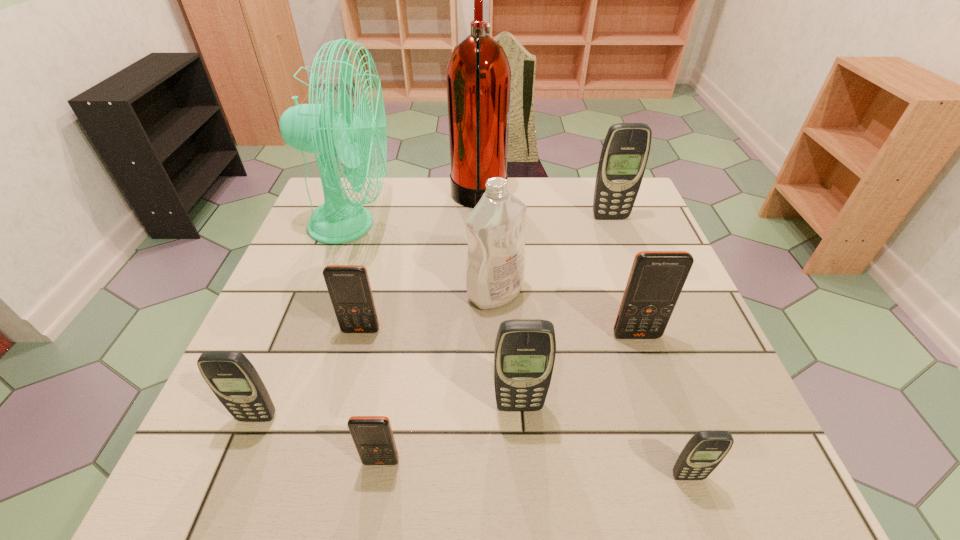
At what (x,y) coordinates should I click in order to perform the action: click on object at the far left corner. Please return your answer as a coordinate pair (x, y). Looking at the image, I should click on (315, 128).

The height and width of the screenshot is (540, 960). Find the location of `object that is at the far right corner`. object that is at the far right corner is located at coordinates (625, 151).

Where is `object that is at the near right corner`? This screenshot has height=540, width=960. object that is at the near right corner is located at coordinates (705, 450).

Find the location of a particular element. This screenshot has width=960, height=540. free space at the far edge of the desktop is located at coordinates tap(456, 216).

What are the coordinates of `vacant space at the near edge` in the screenshot? It's located at (327, 478).

Locate an element on the screen. vacant space at the left edge of the desktop is located at coordinates (257, 327).

In the image, there is a desktop. Identify the location of free space at the near right corner. This screenshot has height=540, width=960. (669, 454).

Where is `vacant area that lies between the nearest gray cellular telephone and the fourth farthest object`? The height and width of the screenshot is (540, 960). vacant area that lies between the nearest gray cellular telephone and the fourth farthest object is located at coordinates (591, 384).

The image size is (960, 540). I want to click on free space between the white detergent and the leftmost orange cellular telephone, so [428, 312].

Identify the location of blank region between the second farthest gray cellular telephone and the leftmost cellular telephone. The height and width of the screenshot is (540, 960). (388, 412).